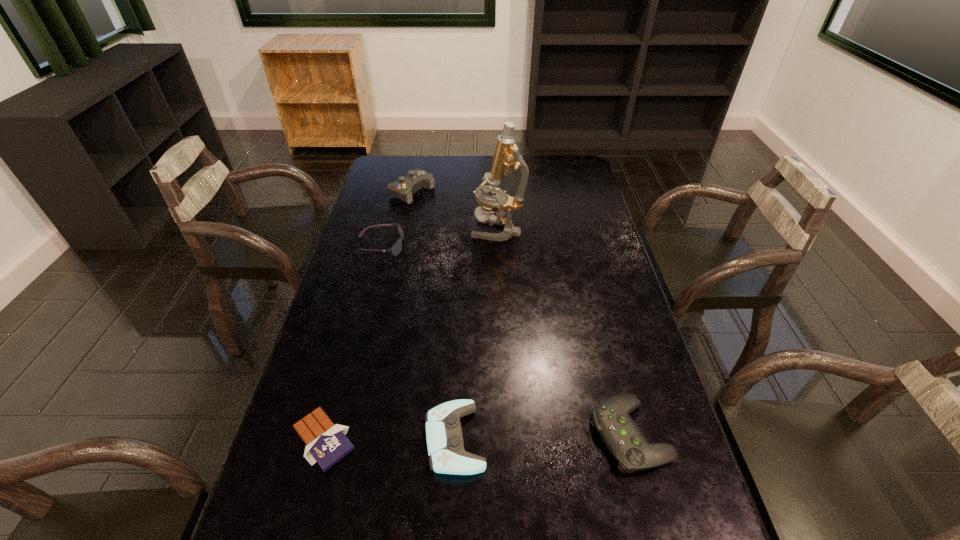
Locate an element on the screen. microscope is located at coordinates (506, 159).

You are a GUI agent. You are given a task and a screenshot of the screen. Output one action in this format:
    pyautogui.click(x=<x>, y=<y>)
    Task: Click on the leftmost control
    This screenshot has width=960, height=540.
    Given the screenshot: What is the action you would take?
    pyautogui.click(x=404, y=188)

At what (x,y) coordinates should I click in order to perform the action: click on the farthest object. Please return your answer as a coordinate pair (x, y). This screenshot has width=960, height=540. Looking at the image, I should click on (404, 188).

This screenshot has height=540, width=960. I want to click on sunglasses, so click(x=397, y=247).

Where is `the second control from right to left`? The width and height of the screenshot is (960, 540). the second control from right to left is located at coordinates point(447,455).

Locate an element on the screen. The width and height of the screenshot is (960, 540). the rightmost control is located at coordinates (623, 438).

Identify the location of chocolate bar. This screenshot has height=540, width=960. (327, 443).

I want to click on free space located on the right of the tallest object, so click(560, 229).

Image resolution: width=960 pixels, height=540 pixels. In order to click on vacant space situated 0.390m on the front of the farthest object in this screenshot , I will do `click(395, 273)`.

Locate an element on the screen. The width and height of the screenshot is (960, 540). free point located 0.170m on the lenses of the sunglasses is located at coordinates tap(453, 246).